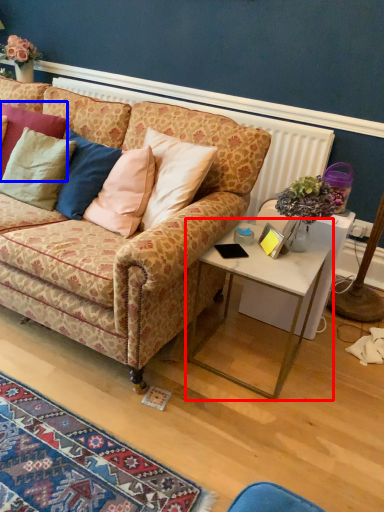
Question: Which object appears closest to the camera in this image, table (highlighted by a red box) or pillow (highlighted by a blue box)?

Choices:
 (A) table
 (B) pillow

Answer: (A)